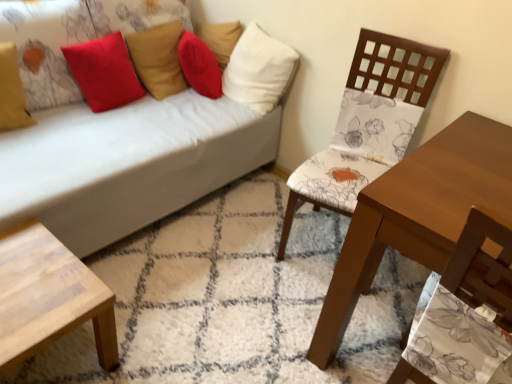
Image resolution: width=512 pixels, height=384 pixels. I want to click on vacant location below floral fabric chair at center right (from a real-world perspective), so click(320, 238).